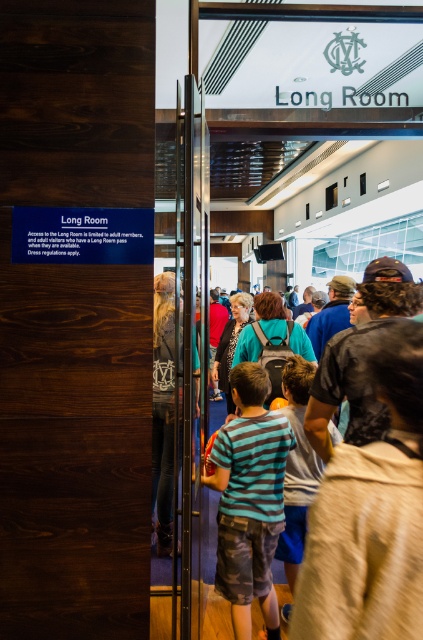
You are standing at the entrance of the Long Room and see a striped cotton shirt at center and a matte blue backpack at center. Which item is taller?

The striped cotton shirt at center is much taller than the matte blue backpack at center.